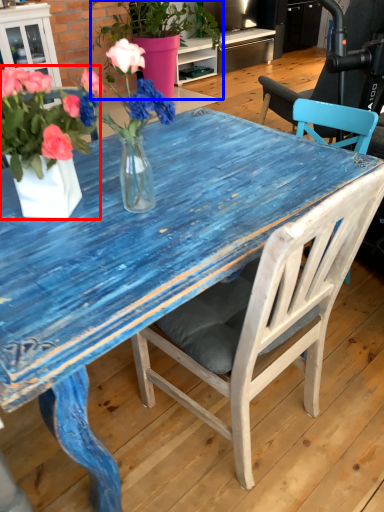
Question: Which of the following is the farthest to the observer, houseplant (highlighted by a red box) or houseplant (highlighted by a blue box)?

Choices:
 (A) houseplant
 (B) houseplant

Answer: (B)